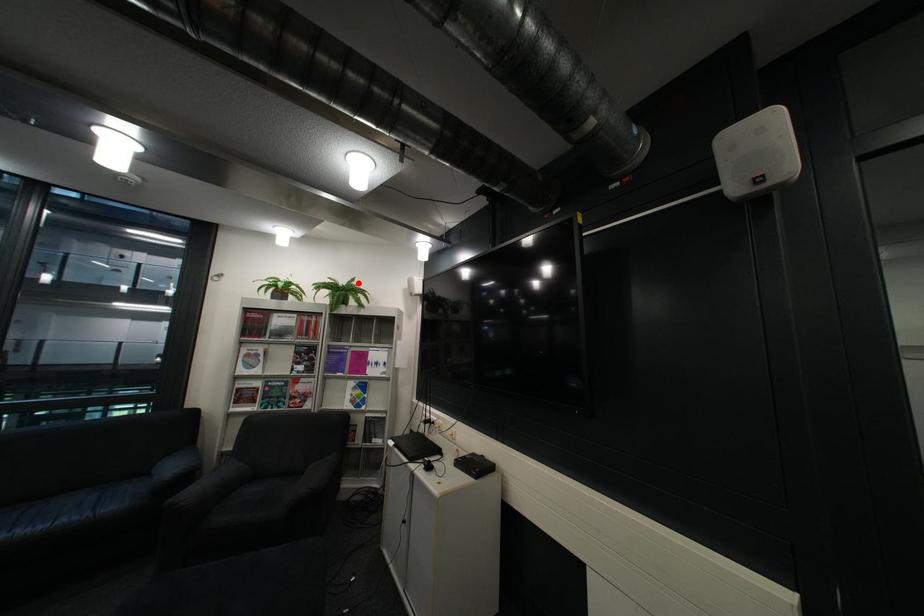
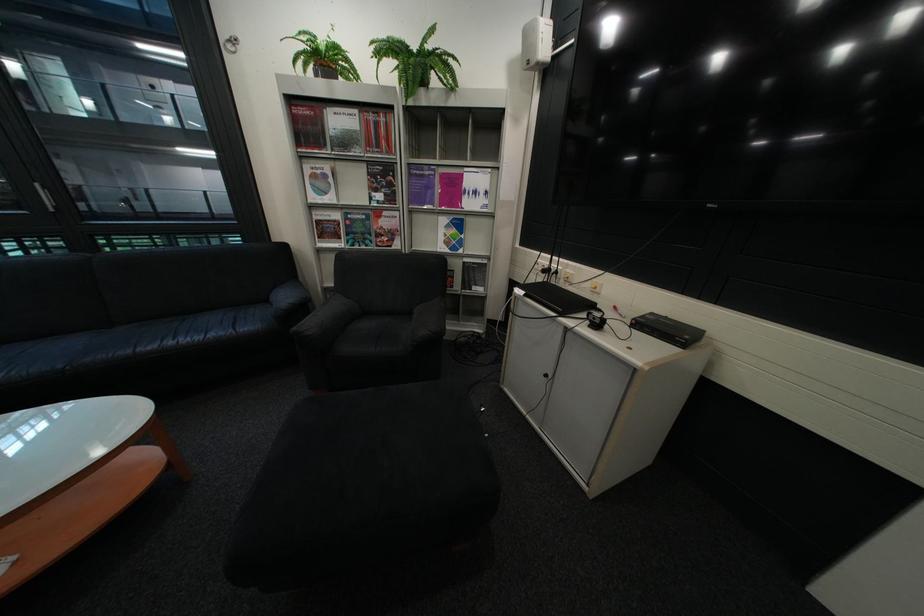
Where in the second image is the point corresponding to the highlighted location from the first image?

(430, 46)